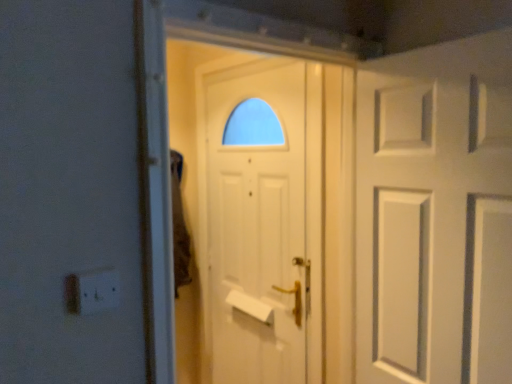
Describe the element at coordinates (256, 221) in the screenshot. I see `white matte door at center, which is the 1th door from left to right` at that location.

The width and height of the screenshot is (512, 384). What do you see at coordinates (435, 214) in the screenshot?
I see `white matte door at right, the first door viewed from the front` at bounding box center [435, 214].

Locate an element on the screen. white matte door at center, which is the 1th door from left to right is located at coordinates (256, 221).

Where is `electric outlet that is under the white matte door at right, the first door viewed from the front (from a real-world perspective)`? electric outlet that is under the white matte door at right, the first door viewed from the front (from a real-world perspective) is located at coordinates (97, 291).

Is white plastic electric outlet at lower left inside or outside of white matte door at right, the first door viewed from the front?

white plastic electric outlet at lower left is located beyond the bounds of white matte door at right, the first door viewed from the front.

What's the angular difference between white plastic electric outlet at lower left and white matte door at right, which is the second door in left-to-right order,'s facing directions?

They differ by 95.3 degrees in their facing directions.

Is white plastic electric outlet at lower left oriented away from white matte door at right, which is the second door in left-to-right order?

white plastic electric outlet at lower left does not have its back to white matte door at right, which is the second door in left-to-right order.

Considering the relative sizes of white matte door at center, placed as the second door when sorted from right to left, and white plastic electric outlet at lower left in the image provided, is white matte door at center, placed as the second door when sorted from right to left, bigger than white plastic electric outlet at lower left?

Correct, white matte door at center, placed as the second door when sorted from right to left, is larger in size than white plastic electric outlet at lower left.

Can you tell me how much white matte door at center, which is the 1th door from left to right, and white plastic electric outlet at lower left differ in facing direction?

They differ by 90.6 degrees in their facing directions.

Could you tell me if white matte door at center, placed as the second door when sorted from right to left, is turned towards white plastic electric outlet at lower left?

No, white matte door at center, placed as the second door when sorted from right to left, is not aimed at white plastic electric outlet at lower left.

From the image's perspective, which one is positioned higher, white matte door at center, which is counted as the 2th door, starting from the front, or white plastic electric outlet at lower left?

white plastic electric outlet at lower left appears higher in the image.

Is white matte door at right, the first door viewed from the front, beside white matte door at center, which is counted as the 2th door, starting from the front?

They are not placed beside each other.

Is white matte door at right, the second door from the back, looking in the opposite direction of white matte door at center, placed as the second door when sorted from right to left?

No, white matte door at right, the second door from the back, is not facing away from white matte door at center, placed as the second door when sorted from right to left.

Considering the positions of objects white matte door at right, the first door viewed from the front, and white matte door at center, which is counted as the 2th door, starting from the front, in the image provided, who is more to the right, white matte door at right, the first door viewed from the front, or white matte door at center, which is counted as the 2th door, starting from the front,?

From the viewer's perspective, white matte door at right, the first door viewed from the front, appears more on the right side.

Looking at this image, would you say white matte door at center, which is the 1th door from left to right, is part of white plastic electric outlet at lower left's contents?

No, white matte door at center, which is the 1th door from left to right, is not inside white plastic electric outlet at lower left.

Does white plastic electric outlet at lower left appear on the right side of white matte door at center, placed as the second door when sorted from right to left?

No, white plastic electric outlet at lower left is not to the right of white matte door at center, placed as the second door when sorted from right to left.

Considering the sizes of objects white plastic electric outlet at lower left and white matte door at center, which is the 1th door in back-to-front order, in the image provided, who is shorter, white plastic electric outlet at lower left or white matte door at center, which is the 1th door in back-to-front order,?

Standing shorter between the two is white plastic electric outlet at lower left.

From the image's perspective, is white matte door at center, placed as the second door when sorted from right to left, under white matte door at right, which is the second door in left-to-right order?

Yes, from the image's perspective, white matte door at center, placed as the second door when sorted from right to left, is beneath white matte door at right, which is the second door in left-to-right order.

Locate an element on the screen. The width and height of the screenshot is (512, 384). door lying in front of the white matte door at center, placed as the second door when sorted from right to left is located at coordinates (435, 214).

From the picture: Is white matte door at center, which is the 1th door from left to right, positioned in front of white matte door at right, the 1th door positioned from the right?

No, it is not.

Which object is wider, white matte door at center, which is the 1th door in back-to-front order, or white matte door at right, the second door from the back?

white matte door at right, the second door from the back.

Is white matte door at right, the 1th door positioned from the right, next to white plastic electric outlet at lower left?

No, white matte door at right, the 1th door positioned from the right, is not touching white plastic electric outlet at lower left.

Considering the relative sizes of white matte door at right, the first door viewed from the front, and white plastic electric outlet at lower left in the image provided, is white matte door at right, the first door viewed from the front, shorter than white plastic electric outlet at lower left?

No, white matte door at right, the first door viewed from the front, is not shorter than white plastic electric outlet at lower left.

From the image's perspective, who appears lower, white matte door at right, the 1th door positioned from the right, or white plastic electric outlet at lower left?

white plastic electric outlet at lower left, from the image's perspective.

How different are the orientations of white matte door at right, which is the second door in left-to-right order, and white plastic electric outlet at lower left in degrees?

The facing directions of white matte door at right, which is the second door in left-to-right order, and white plastic electric outlet at lower left are 95.3 degrees apart.

There is a white plastic electric outlet at lower left. Where is `door above it (from a real-world perspective)`? The height and width of the screenshot is (384, 512). door above it (from a real-world perspective) is located at coordinates (435, 214).

Identify the location of door that is the 1st one when counting rightward from the white plastic electric outlet at lower left. The width and height of the screenshot is (512, 384). (256, 221).

Based on their spatial positions, is white plastic electric outlet at lower left or white matte door at right, the second door from the back, closer to white matte door at center, which is the 1th door from left to right?

white matte door at right, the second door from the back, is positioned closer to the anchor white matte door at center, which is the 1th door from left to right.

Estimate the real-world distances between objects in this image. Which object is closer to white matte door at right, the 1th door positioned from the right, white plastic electric outlet at lower left or white matte door at center, placed as the second door when sorted from right to left?

white matte door at center, placed as the second door when sorted from right to left.

When comparing their distances from white plastic electric outlet at lower left, does white matte door at center, which is the 1th door in back-to-front order, or white matte door at right, which is the second door in left-to-right order, seem further?

Based on the image, white matte door at center, which is the 1th door in back-to-front order, appears to be further to white plastic electric outlet at lower left.

Estimate the real-world distances between objects in this image. Which object is closer to white matte door at right, the second door from the back, white matte door at center, which is counted as the 2th door, starting from the front, or white plastic electric outlet at lower left?

white matte door at center, which is counted as the 2th door, starting from the front, is closer to white matte door at right, the second door from the back.

When comparing their distances from white plastic electric outlet at lower left, does white matte door at right, the 1th door positioned from the right, or white matte door at center, which is the 1th door in back-to-front order, seem further?

white matte door at center, which is the 1th door in back-to-front order, lies further to white plastic electric outlet at lower left than the other object.

Estimate the real-world distances between objects in this image. Which object is further from white matte door at center, which is counted as the 2th door, starting from the front, white matte door at right, the second door from the back, or white plastic electric outlet at lower left?

Among the two, white plastic electric outlet at lower left is located further to white matte door at center, which is counted as the 2th door, starting from the front.

This screenshot has height=384, width=512. What are the coordinates of `door positioned between white plastic electric outlet at lower left and white matte door at center, which is counted as the 2th door, starting from the front, from near to far` in the screenshot? It's located at (435, 214).